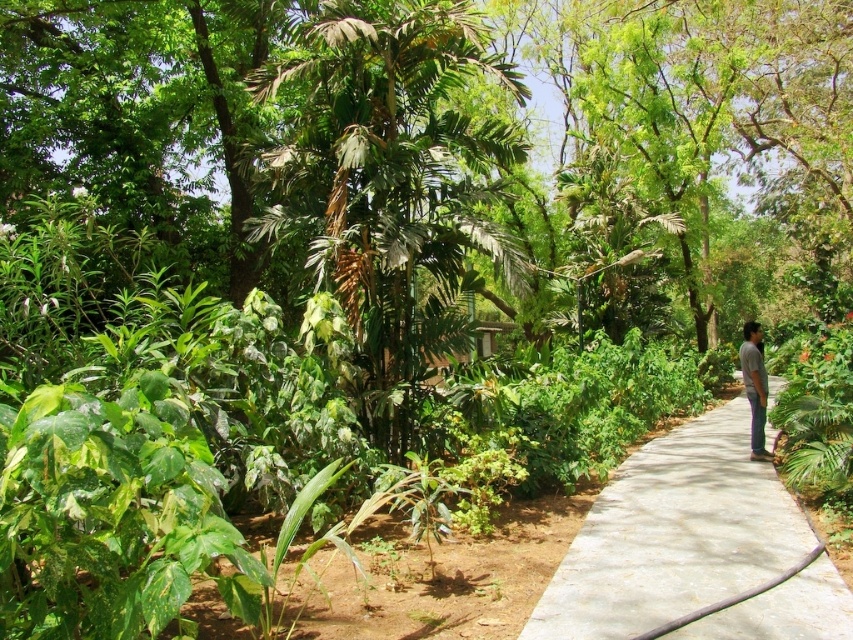
Question: Can you confirm if green leafy tree at center is smaller than gray cotton shirt at right?

Choices:
 (A) yes
 (B) no

Answer: (A)

Question: Which of the following is the closest to the observer?

Choices:
 (A) green leafy tree at center
 (B) gray concrete pavement at center
 (C) gray cotton shirt at right

Answer: (B)

Question: Does gray concrete pavement at center appear on the right side of gray cotton shirt at right?

Choices:
 (A) no
 (B) yes

Answer: (A)

Question: Which point is farther to the camera?

Choices:
 (A) green leafy tree at center
 (B) gray concrete pavement at center
 (C) gray cotton shirt at right

Answer: (C)

Question: Can you confirm if gray concrete pavement at center is positioned to the left of gray cotton shirt at right?

Choices:
 (A) no
 (B) yes

Answer: (B)

Question: Which point is farther from the camera taking this photo?

Choices:
 (A) (331, 177)
 (B) (743, 372)

Answer: (B)